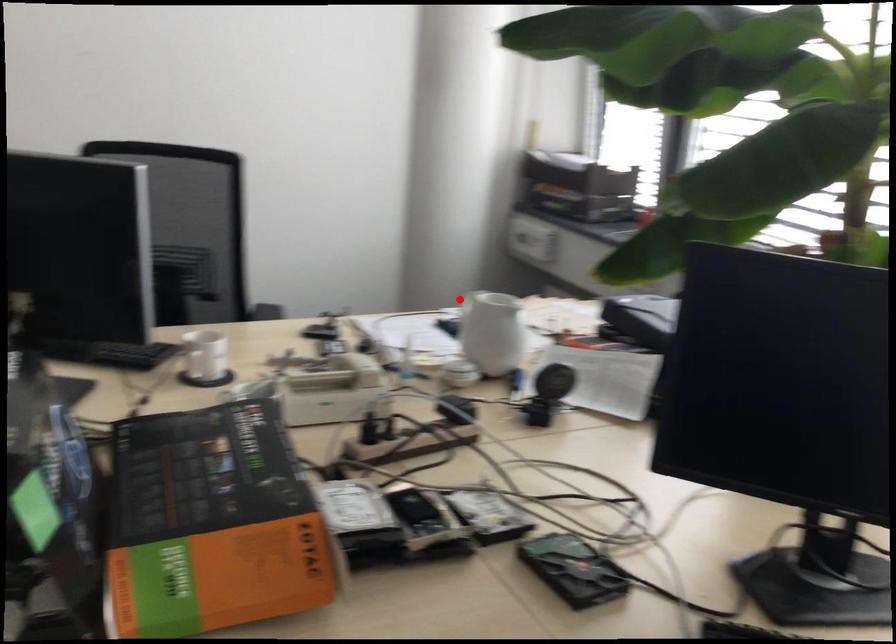
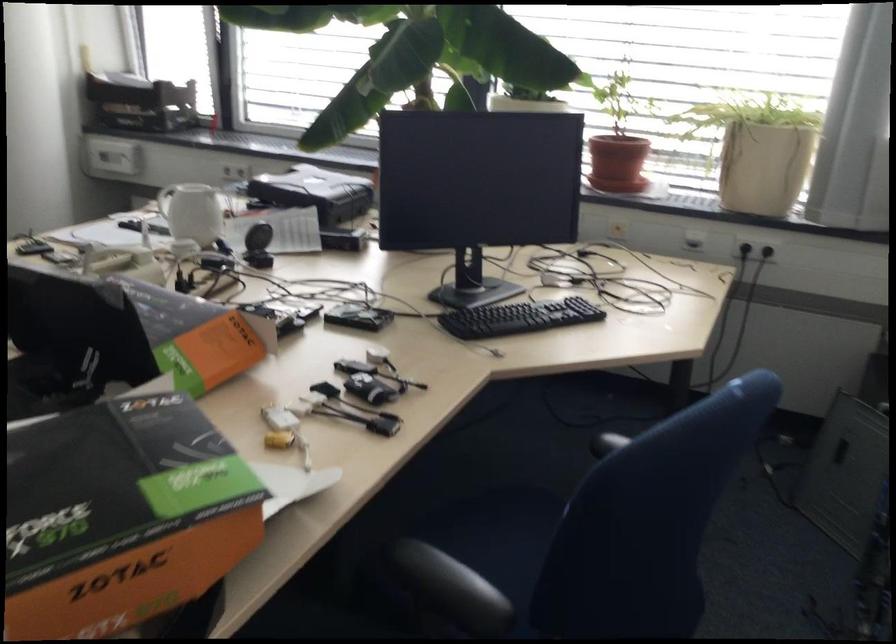
Question: I am providing you with two images of the same scene from different viewpoints. Given a red point in image1, look at the same physical point in image2. Is it:

Choices:
 (A) Closer to the viewpoint
 (B) Farther from the viewpoint

Answer: (B)